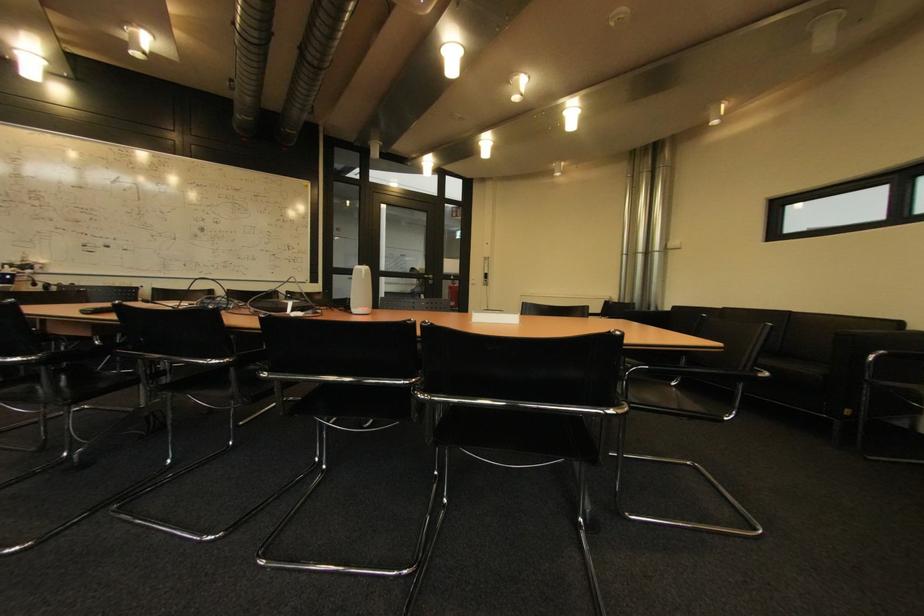
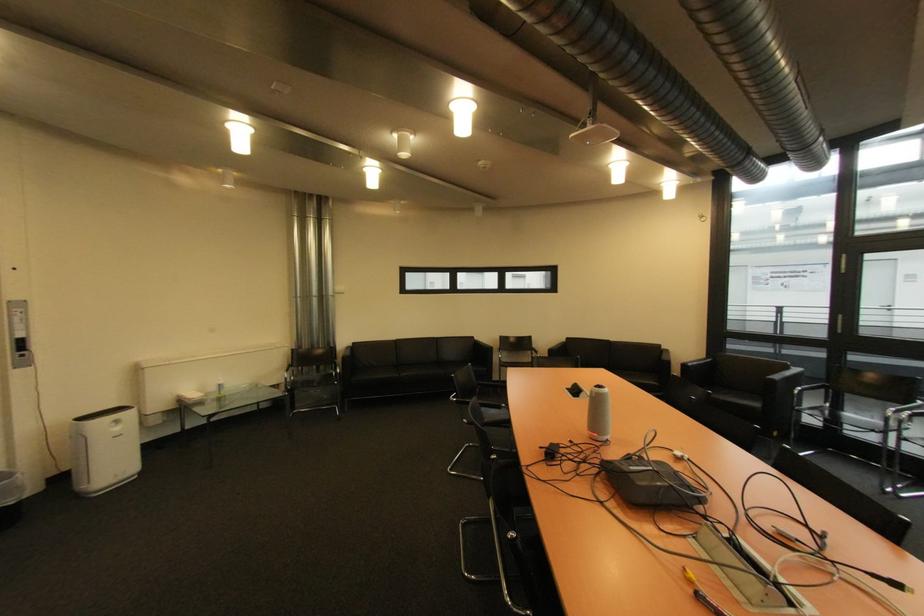
The point at (614, 302) is marked in the first image. Where is the corresponding point in the second image?

(301, 352)